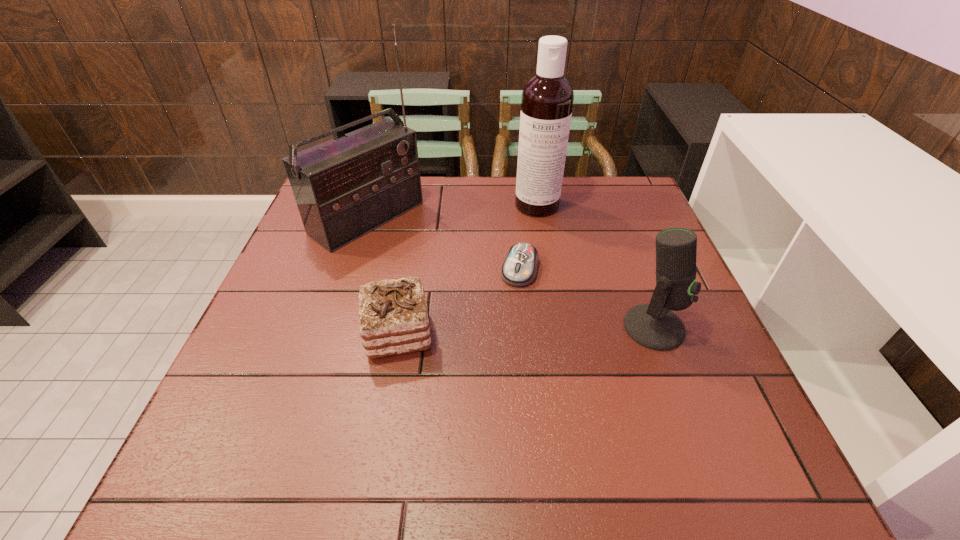
At what (x,y) coordinates should I click in order to perform the action: click on object located at the right edge. Please return your answer as a coordinate pair (x, y). The width and height of the screenshot is (960, 540). Looking at the image, I should click on (654, 326).

At what (x,y) coordinates should I click in order to perform the action: click on object present at the far left corner. Please return your answer as a coordinate pair (x, y). Looking at the image, I should click on (345, 188).

Image resolution: width=960 pixels, height=540 pixels. Find the location of `free space at the far edge of the desktop`. free space at the far edge of the desktop is located at coordinates (504, 188).

The image size is (960, 540). Identify the location of free region at the left edge of the desktop. (255, 320).

Identify the location of free spot at the right edge of the desktop. The width and height of the screenshot is (960, 540). (672, 370).

Locate an element on the screen. free space at the far right corner is located at coordinates (619, 217).

Where is `vacant region between the dishwasher detergent and the third tallest object`? vacant region between the dishwasher detergent and the third tallest object is located at coordinates coord(595,266).

Image resolution: width=960 pixels, height=540 pixels. What are the coordinates of `blank region between the shortest object and the dishwasher detergent` in the screenshot? It's located at (528, 237).

Image resolution: width=960 pixels, height=540 pixels. I want to click on free area in between the microphone and the second shortest object, so click(x=526, y=330).

Locate an element on the screen. vacant region between the radio receiver and the fourth tallest object is located at coordinates (382, 275).